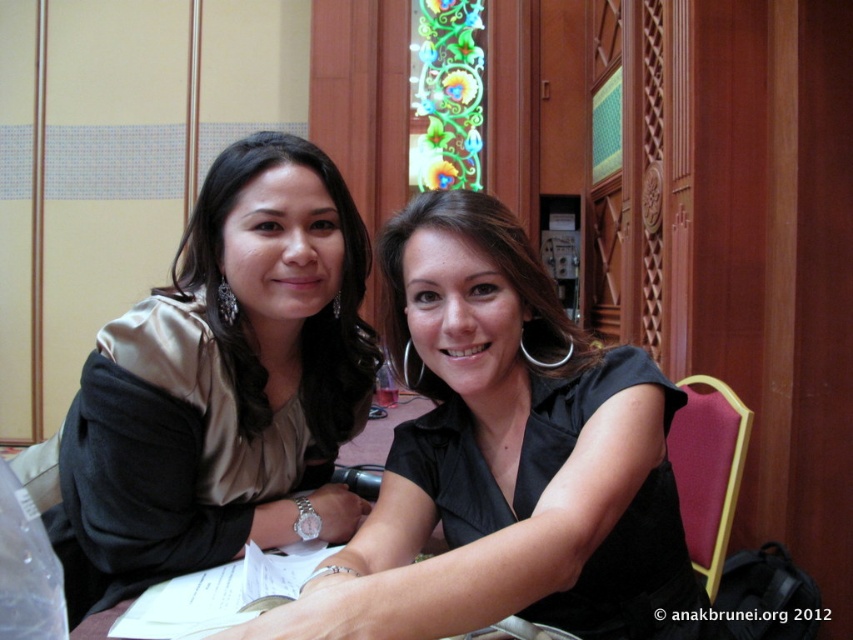
You are taking a photo of the scene and want to ensure both the matte gold blouse at left and the stained glass window at upper center are in focus. Which object should you focus on first to ensure the other remains sharp?

You should focus on the stained glass window at upper center first because it is farther away from the viewer than the matte gold blouse at left, so focusing on the farther object will keep both in focus.

You are a photographer setting up for a shoot in this room. You want to ensure the matte gold blouse at left and the stained glass window at upper center are both visible in the frame. Based on their positions, which object should you position closer to the left side of the camera frame?

The matte gold blouse at left is to the left of the stained glass window at upper center, so you should position the matte gold blouse at left closer to the left side of the camera frame.